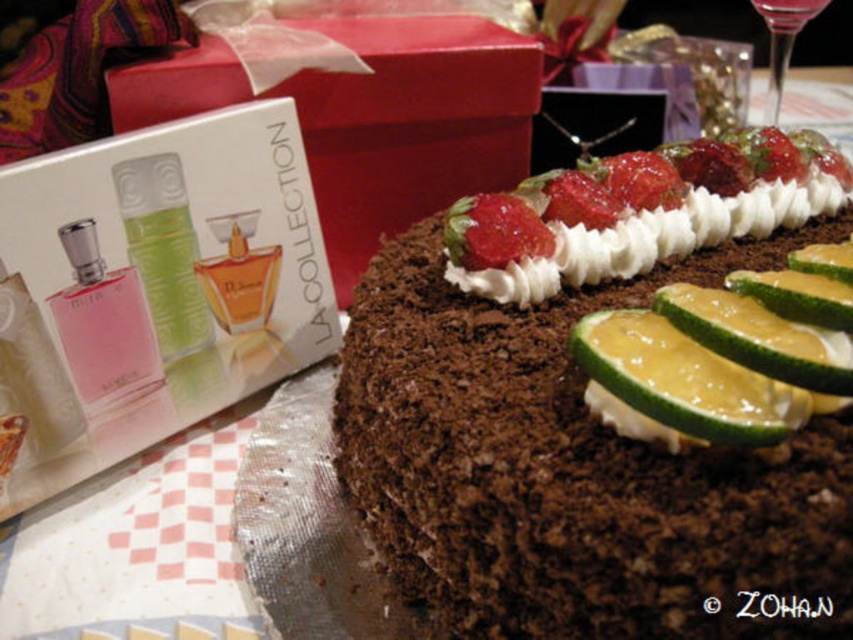
Question: Considering the relative positions of strawberry at center and transparent glass at upper right in the image provided, where is strawberry at center located with respect to transparent glass at upper right?

Choices:
 (A) above
 (B) below

Answer: (B)

Question: Can you confirm if yellow glazed lemon at center is positioned to the left of transparent glass at upper right?

Choices:
 (A) yes
 (B) no

Answer: (A)

Question: Which of the following is the farthest from the observer?

Choices:
 (A) [497, 355]
 (B) [682, 316]

Answer: (A)

Question: Is yellow smooth lemon at center smaller than yellow glazed lemon at right?

Choices:
 (A) no
 (B) yes

Answer: (A)

Question: Which point is farther to the camera?

Choices:
 (A) transparent glass at upper right
 (B) chocolatecrumblycake at right
 (C) yellow smooth lemon at center
 (D) strawberry at center

Answer: (A)

Question: Which object appears closest to the camera in this image?

Choices:
 (A) chocolatecrumblycake at right
 (B) yellow glazed lemon at center
 (C) strawberry at center

Answer: (A)